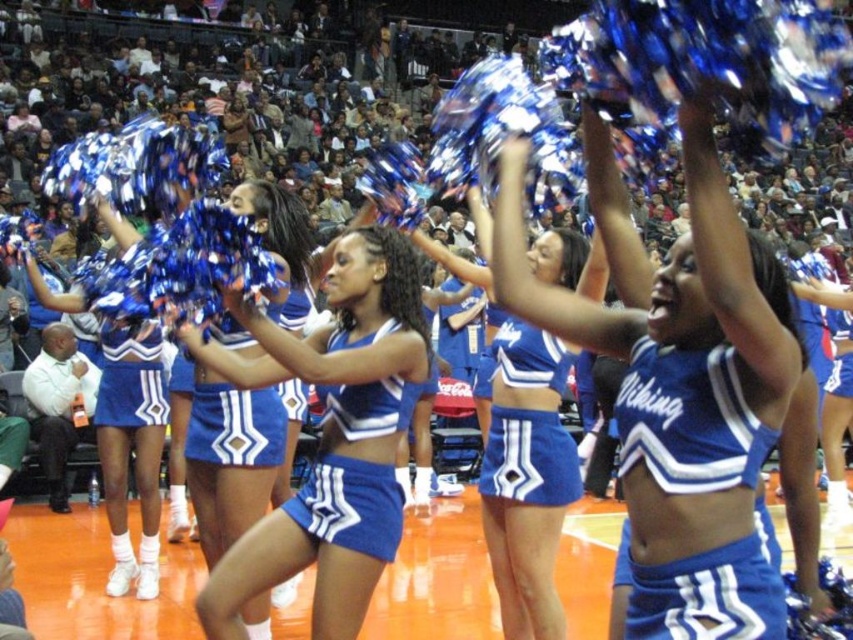
Who is taller, matte blue cheerleading outfit at center or matte blue uniform at center?

matte blue cheerleading outfit at center

Can you confirm if matte blue cheerleading outfit at center is taller than matte blue uniform at center?

Indeed, matte blue cheerleading outfit at center has a greater height compared to matte blue uniform at center.

Locate an element on the screen. matte blue cheerleading outfit at center is located at coordinates (329, 436).

This screenshot has height=640, width=853. What are the coordinates of `matte blue cheerleading outfit at center` in the screenshot? It's located at (329, 436).

Is the position of blue shiny fabric cheerleading outfit at center more distant than that of blue jersey at center?

That is False.

Can you confirm if blue shiny fabric cheerleading outfit at center is positioned to the left of blue jersey at center?

Correct, you'll find blue shiny fabric cheerleading outfit at center to the left of blue jersey at center.

Who is more distant from viewer, (398,380) or (540,368)?

Point (540,368)

Locate an element on the screen. This screenshot has width=853, height=640. blue shiny fabric cheerleading outfit at center is located at coordinates (350, 504).

Is blue shiny pom-poms at upper center thinner than blue jersey at center?

In fact, blue shiny pom-poms at upper center might be wider than blue jersey at center.

Is blue shiny pom-poms at upper center to the left of blue jersey at center from the viewer's perspective?

Incorrect, blue shiny pom-poms at upper center is not on the left side of blue jersey at center.

Is point (595, 138) more distant than point (512, 368)?

No, (595, 138) is closer to viewer.

Find the location of a particular element. blue shiny pom-poms at upper center is located at coordinates (677, 381).